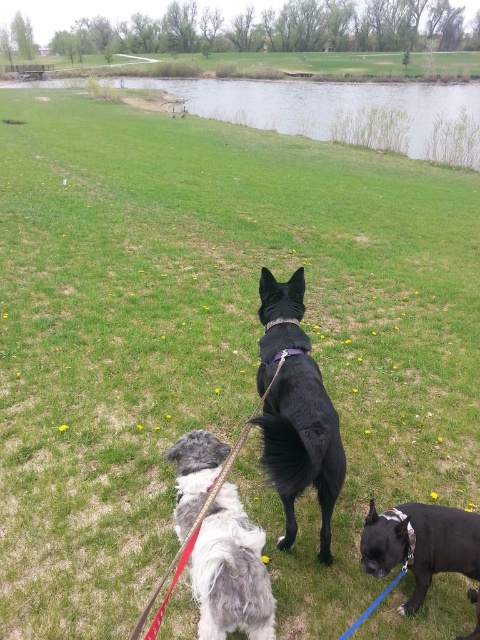
Consider the image. You are standing in the middle of the grassy field and want to climb up to the green grassy bank at upper center. Based on the coordinates provided, can you estimate how far you need to walk horizontally to reach it?

The green grassy bank at upper center is located at coordinates point (342,112). To reach it from the middle of the grassy field, you would need to walk approximately 0.175 units horizontally to the left.

You are standing at the point labeled point (342,112) in the image. Looking around, you see two dogs on leashes and a third partially visible dog. Which direction should you walk to reach the green grassy bank at upper center?

The point labeled point (342,112) is already located at the green grassy bank at upper center, so you are already there.